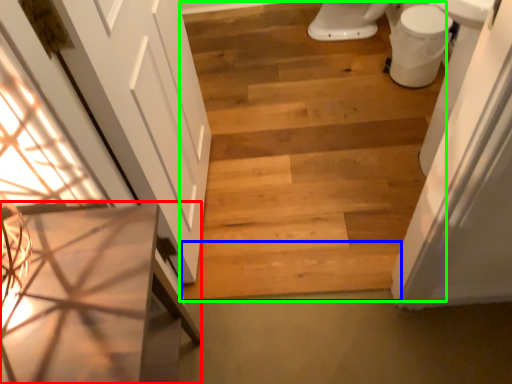
Question: Based on their relative distances, which object is nearer to vanity (highlighted by a red box)? Choose from plank (highlighted by a blue box) and stairwell (highlighted by a green box).

Choices:
 (A) plank
 (B) stairwell

Answer: (A)